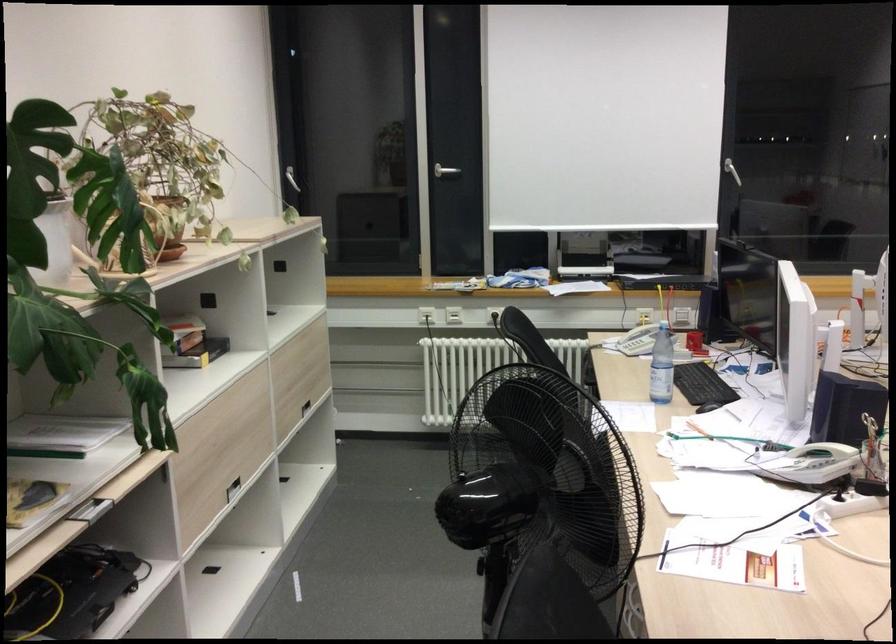
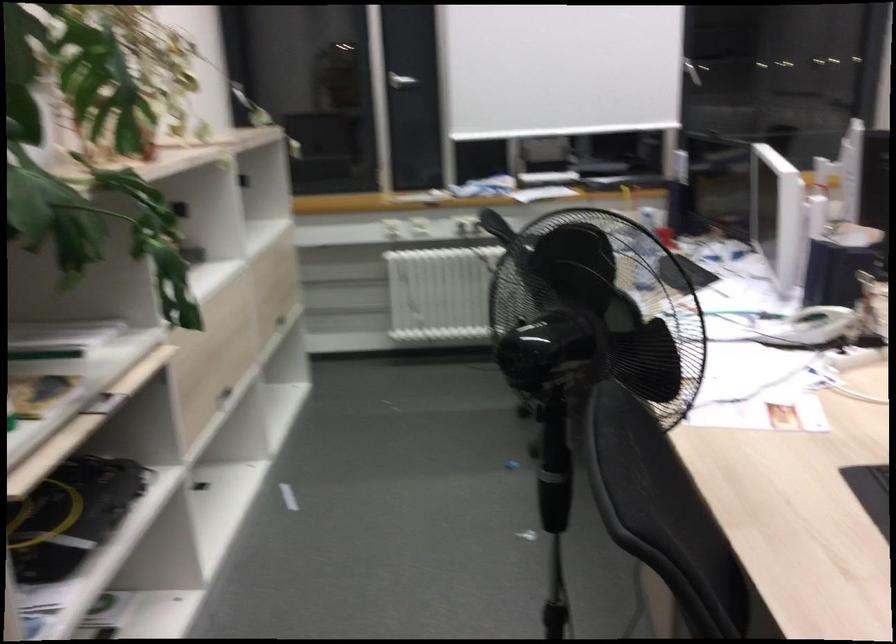
Question: I am providing you with two images of the same scene from different viewpoints. Please identify which objects are invisible in image2.

Choices:
 (A) blue filter housing
 (B) white telephone handset
 (C) drawer handle
 (D) stack of books

Answer: (D)